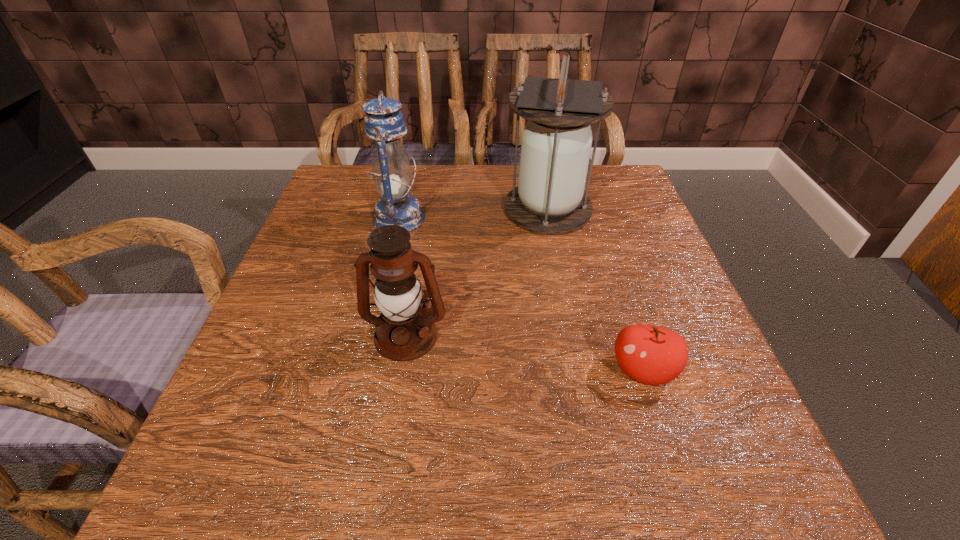
The height and width of the screenshot is (540, 960). In order to click on the rightmost lantern in this screenshot , I will do `click(556, 142)`.

The width and height of the screenshot is (960, 540). What are the coordinates of `the nearest lantern` in the screenshot? It's located at (405, 331).

Find the location of `apple`. apple is located at coordinates 653,355.

Locate an element on the screen. vacant space situated 0.250m on the front of the rightmost lantern is located at coordinates (569, 321).

You are a GUI agent. You are given a task and a screenshot of the screen. Output one action in this format:
    pyautogui.click(x=<x>, y=<y>)
    Task: Click on the vacant space located on the side of the nearest lantern, there is a wick adjustment knob
    The width and height of the screenshot is (960, 540).
    Given the screenshot: What is the action you would take?
    pyautogui.click(x=393, y=417)

I want to click on free space located on the left of the shortest object, so click(454, 371).

Identify the location of object present at the left edge. Image resolution: width=960 pixels, height=540 pixels. (384, 124).

You are a GUI agent. You are given a task and a screenshot of the screen. Output one action in this format:
    pyautogui.click(x=<x>, y=<y>)
    Task: Click on the lantern situated at the right edge
    This screenshot has height=540, width=960.
    Given the screenshot: What is the action you would take?
    pyautogui.click(x=556, y=142)

The width and height of the screenshot is (960, 540). I want to click on apple at the right edge, so point(653,355).

Identify the location of object at the far left corner. The image size is (960, 540). (384, 124).